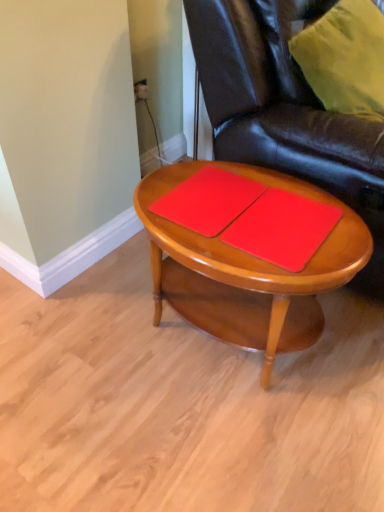
This screenshot has height=512, width=384. I want to click on vacant space underneath matte red notebook at center, which is the 2th notebook in right-to-left order (from a real-world perspective), so click(x=203, y=199).